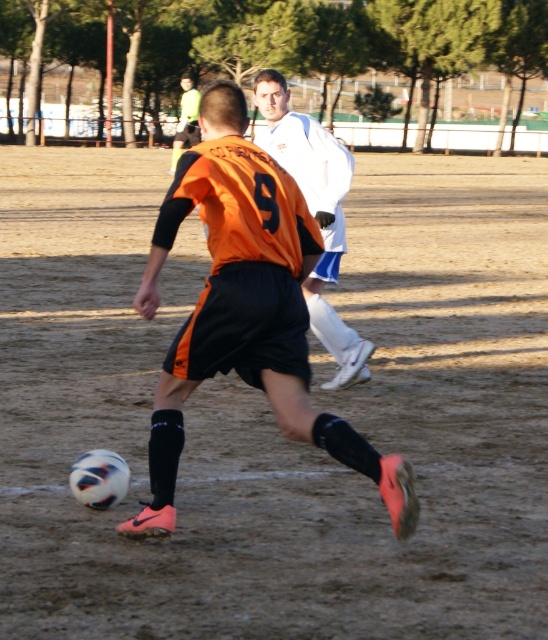
You are a photographer positioned at the camera location. You want to capture a closeup shot of the orange matte jersey at center. Considering the distance, can you get a clear closeup without moving your position?

The orange matte jersey at center is 5.31 meters from the camera. Whether you can get a clear closeup depends on your camera lens. A standard lens might require zooming in, but if your camera has a high enough megapixel count or a zoom lens capable of reaching at least 200mm, you should be able to capture a clear closeup from that distance without moving.

You are a soccer coach analyzing the game from the sidelines. You notice two points marked on the field at coordinates point (248, 384) and point (193, 113). Which point is nearer to your vantage point on the sidelines?

Point (248, 384) is closer to the camera than point (193, 113), so the point (248, 384) is nearer to your vantage point on the sidelines.